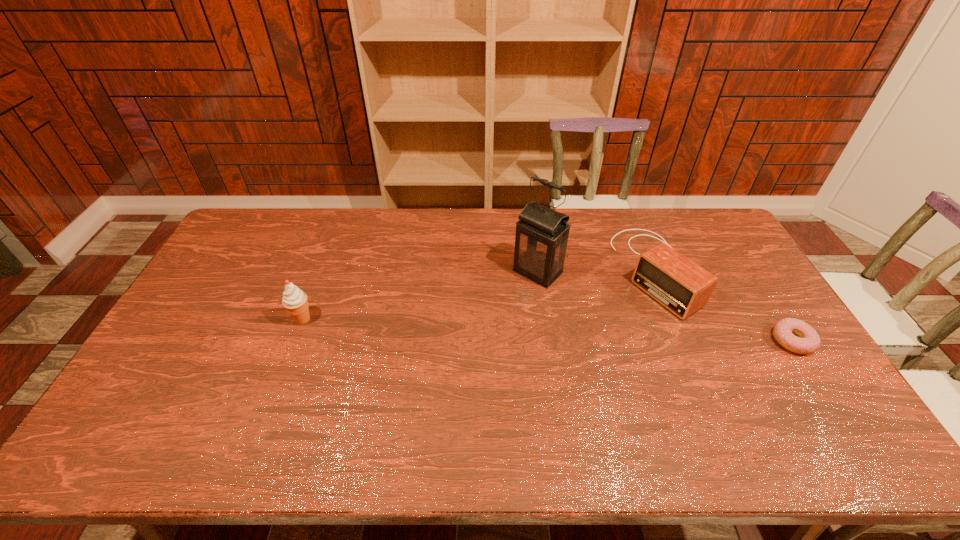
Where is `the leftmost object`? This screenshot has width=960, height=540. the leftmost object is located at coordinates (294, 300).

At what (x,y) coordinates should I click in order to perform the action: click on icecream. Please return your answer as a coordinate pair (x, y). The width and height of the screenshot is (960, 540). Looking at the image, I should click on (294, 300).

Locate an element on the screen. The width and height of the screenshot is (960, 540). doughnut is located at coordinates [808, 340].

The width and height of the screenshot is (960, 540). I want to click on the rightmost object, so click(x=808, y=340).

Identify the location of the third object from right to left. This screenshot has height=540, width=960. 542,233.

Find the location of a particular element. The height and width of the screenshot is (540, 960). lantern is located at coordinates (542, 233).

Locate an element on the screen. Image resolution: width=960 pixels, height=540 pixels. radio receiver is located at coordinates (683, 287).

Identify the location of the third object from left to right. coord(683,287).

The image size is (960, 540). Identify the location of vacant space positioned on the back of the leftmost object. (320, 275).

Locate an element on the screen. This screenshot has width=960, height=540. free spot located 0.290m on the back of the doughnut is located at coordinates (741, 261).